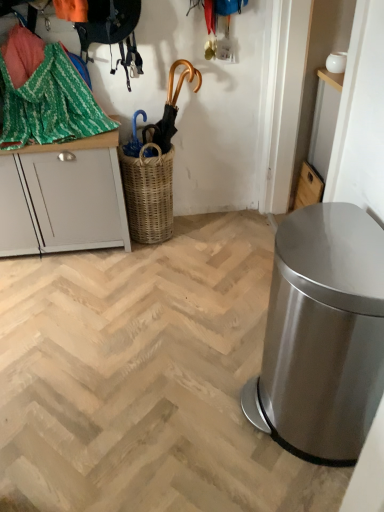
Question: Does woven brown basket at center have a greater width compared to green woven fabric at upper left?

Choices:
 (A) yes
 (B) no

Answer: (B)

Question: Considering the relative positions of woven brown basket at center and green woven fabric at upper left in the image provided, is woven brown basket at center to the right of green woven fabric at upper left from the viewer's perspective?

Choices:
 (A) yes
 (B) no

Answer: (A)

Question: Is woven brown basket at center aimed at green woven fabric at upper left?

Choices:
 (A) no
 (B) yes

Answer: (A)

Question: Is woven brown basket at center closer to camera compared to green woven fabric at upper left?

Choices:
 (A) yes
 (B) no

Answer: (B)

Question: Is woven brown basket at center touching green woven fabric at upper left?

Choices:
 (A) no
 (B) yes

Answer: (A)

Question: Does woven brown basket at center have a larger size compared to green woven fabric at upper left?

Choices:
 (A) yes
 (B) no

Answer: (B)

Question: Would you say wooden cabinet at upper right, the 2th cabinetry in the left-to-right sequence, is outside white painted wood cabinet at left, which is the 1th cabinetry from left to right?

Choices:
 (A) no
 (B) yes

Answer: (B)

Question: Is wooden cabinet at upper right, the 2th cabinetry in the left-to-right sequence, with white painted wood cabinet at left, marked as the 2th cabinetry in a right-to-left arrangement?

Choices:
 (A) no
 (B) yes

Answer: (A)

Question: Considering the relative sizes of wooden cabinet at upper right, the 2th cabinetry in the left-to-right sequence, and white painted wood cabinet at left, marked as the 2th cabinetry in a right-to-left arrangement, in the image provided, is wooden cabinet at upper right, the 2th cabinetry in the left-to-right sequence, bigger than white painted wood cabinet at left, marked as the 2th cabinetry in a right-to-left arrangement,?

Choices:
 (A) no
 (B) yes

Answer: (A)

Question: From the image's perspective, is wooden cabinet at upper right, the 1th cabinetry in the right-to-left sequence, under white painted wood cabinet at left, marked as the 2th cabinetry in a right-to-left arrangement?

Choices:
 (A) no
 (B) yes

Answer: (B)

Question: Is wooden cabinet at upper right, the 2th cabinetry in the left-to-right sequence, behind white painted wood cabinet at left, marked as the 2th cabinetry in a right-to-left arrangement?

Choices:
 (A) no
 (B) yes

Answer: (B)

Question: From a real-world perspective, is wooden cabinet at upper right, the 2th cabinetry in the left-to-right sequence, below white painted wood cabinet at left, marked as the 2th cabinetry in a right-to-left arrangement?

Choices:
 (A) no
 (B) yes

Answer: (B)

Question: Does gold metallic umbrella at upper center have a greater width compared to green woven fabric at upper left?

Choices:
 (A) no
 (B) yes

Answer: (A)